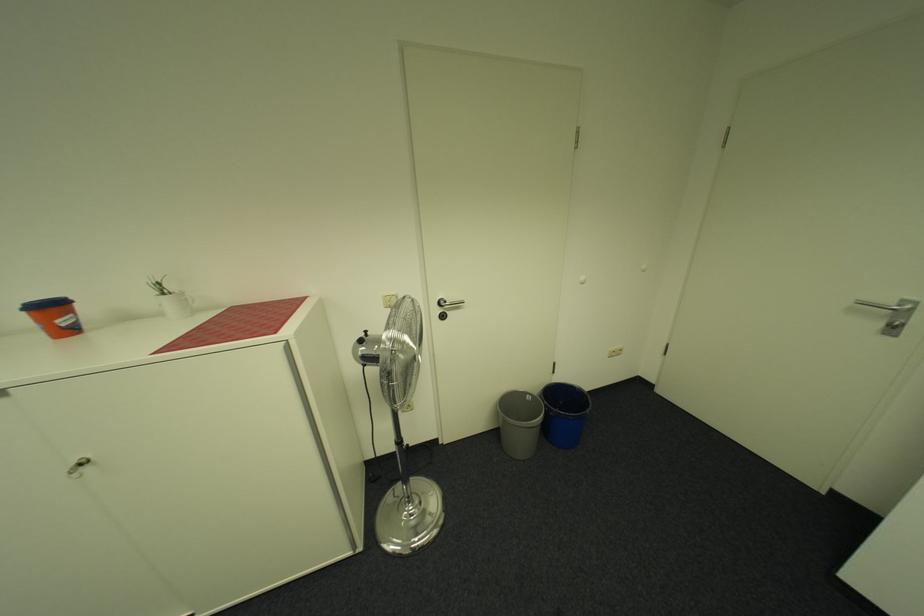
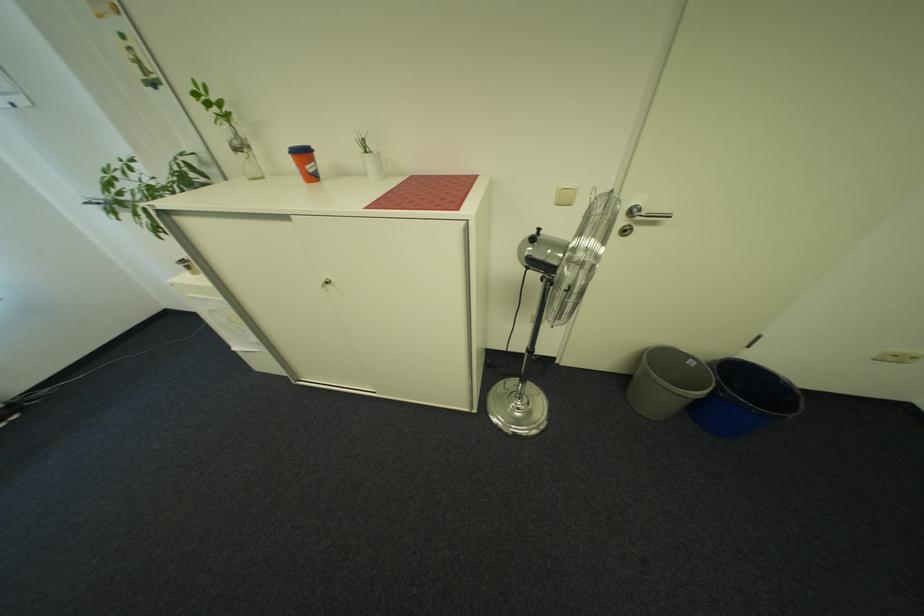
Where in the second image is the point corresponding to [67,322] from the first image?

(317, 168)